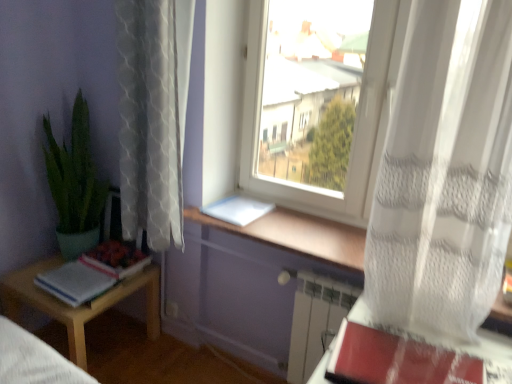
Locate an element on the screen. This screenshot has height=384, width=512. light wood table at lower left is located at coordinates (80, 306).

Image resolution: width=512 pixels, height=384 pixels. I want to click on white plastic window at center, so 317,102.

Measure the distance between green matte plant at left and camera.

green matte plant at left is 6.69 feet away from camera.

Describe the element at coordinates (396, 360) in the screenshot. The image size is (512, 384). I see `red matte paperback book at lower right, placed as the second paperback book when sorted from left to right` at that location.

Image resolution: width=512 pixels, height=384 pixels. What do you see at coordinates (93, 272) in the screenshot?
I see `white paper book at lower left` at bounding box center [93, 272].

What are the coordinates of `wooden bed frame at lower left` in the screenshot? It's located at (34, 360).

Is white lace curtain at left, placed as the 1th curtain when sorted from left to right, beside white plastic window at center?

No, white lace curtain at left, placed as the 1th curtain when sorted from left to right, is not with white plastic window at center.

Is point (132, 50) in front of point (346, 100)?

That is True.

Can you tell me how much white lace curtain at left, placed as the 2th curtain when sorted from right to left, and white plastic window at center differ in facing direction?

They differ by 4.37 degrees in their facing directions.

Is white lace curtain at left, placed as the 2th curtain when sorted from right to left, facing towards white plastic window at center?

No, white lace curtain at left, placed as the 2th curtain when sorted from right to left, is not turned towards white plastic window at center.

Locate an element on the screen. The height and width of the screenshot is (384, 512). table that is in front of the white paper at window, the first paperback book positioned from the left is located at coordinates (80, 306).

Considering the positions of points (74, 338) and (241, 199), is point (74, 338) farther from camera compared to point (241, 199)?

No.

Can you confirm if light wood table at lower left is smaller than white paper at window, the first paperback book positioned from the back?

No.

Considering the positions of objects light wood table at lower left and white paper at window, the first paperback book positioned from the left, in the image provided, who is more to the left, light wood table at lower left or white paper at window, the first paperback book positioned from the left,?

From the viewer's perspective, light wood table at lower left appears more on the left side.

Is white paper at window, the first paperback book positioned from the back, looking in the opposite direction of wooden bed frame at lower left?

white paper at window, the first paperback book positioned from the back, does not have its back to wooden bed frame at lower left.

Between white paper at window, the first paperback book positioned from the left, and wooden bed frame at lower left, which one has smaller size?

With smaller size is white paper at window, the first paperback book positioned from the left.

Which object is closer to the camera, white paper at window, the first paperback book positioned from the left, or wooden bed frame at lower left?

wooden bed frame at lower left is closer to the camera.

Considering the sizes of white paper at window, marked as the 2th paperback book in a front-to-back arrangement, and wooden bed frame at lower left in the image, is white paper at window, marked as the 2th paperback book in a front-to-back arrangement, taller or shorter than wooden bed frame at lower left?

Clearly, white paper at window, marked as the 2th paperback book in a front-to-back arrangement, is shorter compared to wooden bed frame at lower left.

Is light wood table at lower left in front of or behind white paper book at lower left in the image?

light wood table at lower left is positioned closer to the viewer than white paper book at lower left.

In the image, there is a light wood table at lower left. Identify the location of book above it (from the image's perspective). (93, 272).

Is light wood table at lower left inside or outside of white paper book at lower left?

The correct answer is: outside.

Who is shorter, red matte paperback book at lower right, which is the second paperback book in top-to-bottom order, or wooden bed frame at lower left?

red matte paperback book at lower right, which is the second paperback book in top-to-bottom order.

Does red matte paperback book at lower right, which is the second paperback book in top-to-bottom order, touch wooden bed frame at lower left?

No, red matte paperback book at lower right, which is the second paperback book in top-to-bottom order, is not beside wooden bed frame at lower left.

Can you tell me how much red matte paperback book at lower right, which is the 1th paperback book from bottom to top, and wooden bed frame at lower left differ in facing direction?

red matte paperback book at lower right, which is the 1th paperback book from bottom to top, and wooden bed frame at lower left are facing 173 degrees away from each other.

Measure the distance from red matte paperback book at lower right, placed as the second paperback book when sorted from left to right, to wooden bed frame at lower left.

red matte paperback book at lower right, placed as the second paperback book when sorted from left to right, and wooden bed frame at lower left are 1.00 meters apart.

Which is less distant, (63, 174) or (5, 322)?

The point (5, 322) is closer.

How different are the orientations of green matte plant at left and wooden bed frame at lower left in degrees?

The angle between the facing direction of green matte plant at left and the facing direction of wooden bed frame at lower left is 178 degrees.

Measure the distance between green matte plant at left and wooden bed frame at lower left.

31.72 inches.

Is green matte plant at left at the left side of wooden bed frame at lower left?

Yes.

From a real-world perspective, who is located higher, white lace curtain at left, placed as the 1th curtain when sorted from left to right, or white paper book at lower left?

Result: From a 3D spatial view, white lace curtain at left, placed as the 1th curtain when sorted from left to right, is above.

Does white lace curtain at left, placed as the 2th curtain when sorted from right to left, have a lesser width compared to white paper book at lower left?

Indeed, white lace curtain at left, placed as the 2th curtain when sorted from right to left, has a lesser width compared to white paper book at lower left.

Is white lace curtain at left, placed as the 1th curtain when sorted from left to right, located outside white paper book at lower left?

Indeed, white lace curtain at left, placed as the 1th curtain when sorted from left to right, is completely outside white paper book at lower left.

You are a GUI agent. You are given a task and a screenshot of the screen. Output one action in this format:
    pyautogui.click(x=<x>, y=<y>)
    Task: Click on the window that is in front of the white lace curtain at left, placed as the 2th curtain when sorted from right to left
    
    Given the screenshot: What is the action you would take?
    pyautogui.click(x=317, y=102)

This screenshot has height=384, width=512. There is a light wood table at lower left. What are the coordinates of `the 2nd paperback book above it (from a real-world perspective)` in the screenshot? It's located at (238, 210).

Considering their positions, is white paper book at lower left positioned further to light wood table at lower left than wooden bed frame at lower left?

wooden bed frame at lower left lies further to light wood table at lower left than the other object.

When comparing their distances from white paper book at lower left, does white sheer curtain at right, which is the 1th curtain from right to left, or light wood table at lower left seem closer?

Answer: Based on the image, light wood table at lower left appears to be nearer to white paper book at lower left.

Which object lies nearer to the anchor point white sheer curtain at right, the 2th curtain viewed from the left, white plastic window at center or white lace curtain at left, placed as the 1th curtain when sorted from left to right?

white lace curtain at left, placed as the 1th curtain when sorted from left to right, is positioned closer to the anchor white sheer curtain at right, the 2th curtain viewed from the left.

When comparing their distances from wooden bed frame at lower left, does white lace curtain at left, placed as the 2th curtain when sorted from right to left, or red matte paperback book at lower right, the 1th paperback book positioned from the front, seem further?

red matte paperback book at lower right, the 1th paperback book positioned from the front, lies further to wooden bed frame at lower left than the other object.

Which object lies further to the anchor point white sheer curtain at right, the 2th curtain viewed from the left, light wood table at lower left or wooden bed frame at lower left?

light wood table at lower left is further to white sheer curtain at right, the 2th curtain viewed from the left.

Based on their spatial positions, is white paper at window, the first paperback book positioned from the left, or white sheer curtain at right, the 2th curtain viewed from the left, further from wooden bed frame at lower left?

Among the two, white sheer curtain at right, the 2th curtain viewed from the left, is located further to wooden bed frame at lower left.

From the image, which object appears to be nearer to light wood table at lower left, white paper book at lower left or green matte plant at left?

Based on the image, white paper book at lower left appears to be nearer to light wood table at lower left.

Which object lies further to the anchor point white lace curtain at left, placed as the 1th curtain when sorted from left to right, red matte paperback book at lower right, which is the second paperback book in top-to-bottom order, or wooden bed frame at lower left?

Based on the image, red matte paperback book at lower right, which is the second paperback book in top-to-bottom order, appears to be further to white lace curtain at left, placed as the 1th curtain when sorted from left to right.

This screenshot has width=512, height=384. Identify the location of book that lies between white lace curtain at left, placed as the 2th curtain when sorted from right to left, and wooden bed frame at lower left from top to bottom. (93, 272).

Where is `bed frame between green matte plant at left and white plastic window at center from left to right`? bed frame between green matte plant at left and white plastic window at center from left to right is located at coordinates (34, 360).

I want to click on bed frame between green matte plant at left and light wood table at lower left in the up-down direction, so click(34, 360).

Image resolution: width=512 pixels, height=384 pixels. What are the coordinates of `bed frame located between light wood table at lower left and white paper at window, marked as the 2th paperback book in a front-to-back arrangement, in the left-right direction` in the screenshot? It's located at 34,360.